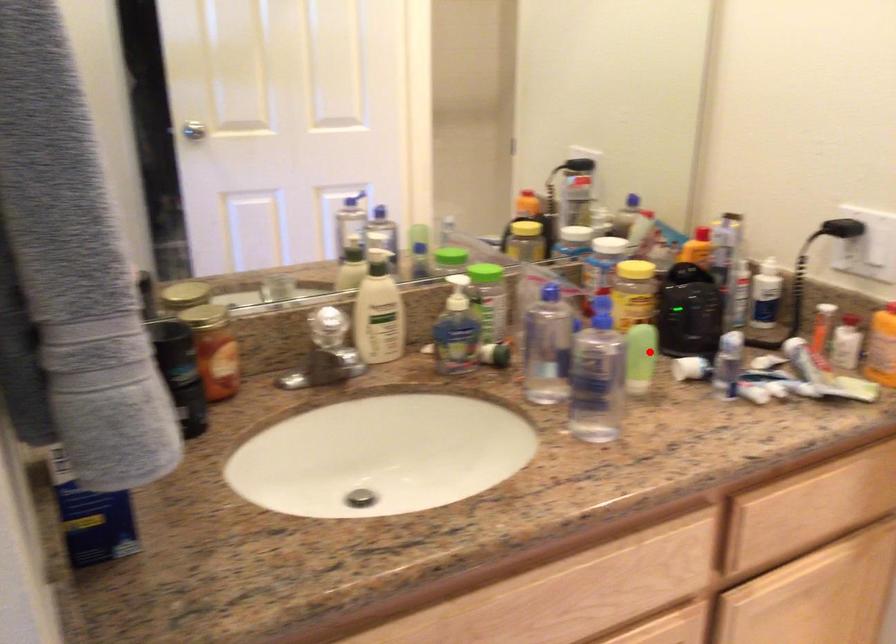
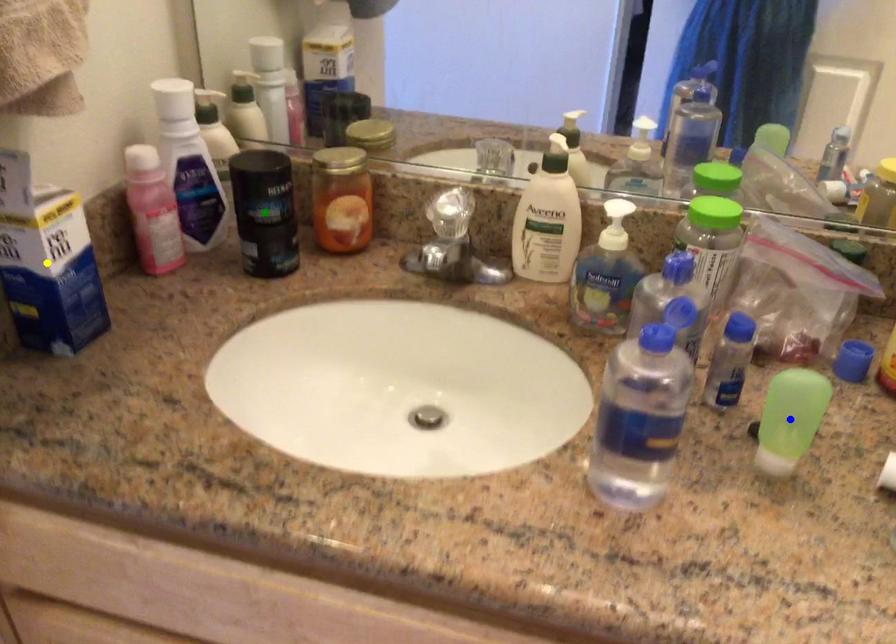
Question: I am providing you with two images of the same scene from different viewpoints. A red point is marked on the first image. You are given multiple points on the second image. Which spot in image 2 lines up with the point in image 1?

Choices:
 (A) blue point
 (B) green point
 (C) yellow point

Answer: (A)